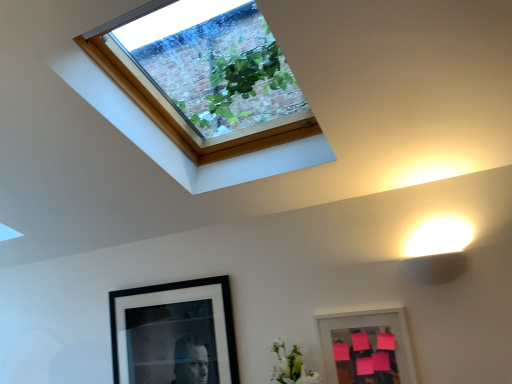
Question: Is black matte picture frame at lower left, the first picture frame when ordered from left to right, taller or shorter than white matte flower at lower center?

Choices:
 (A) short
 (B) tall

Answer: (B)

Question: Is black matte picture frame at lower left, which is the second picture frame from right to left, wider or thinner than white matte flower at lower center?

Choices:
 (A) thin
 (B) wide

Answer: (A)

Question: Considering the real-world distances, which object is farthest from the pink matte picture frame at lower right, the second picture frame viewed from the back?

Choices:
 (A) clear glass window at upper center
 (B) black matte picture frame at lower left, the first picture frame when ordered from left to right
 (C) white matte flower at lower center

Answer: (A)

Question: Which of these objects is positioned closest to the white matte flower at lower center?

Choices:
 (A) pink matte picture frame at lower right, the 1th picture frame when ordered from right to left
 (B) black matte picture frame at lower left, the second picture frame in the front-to-back sequence
 (C) clear glass window at upper center

Answer: (A)